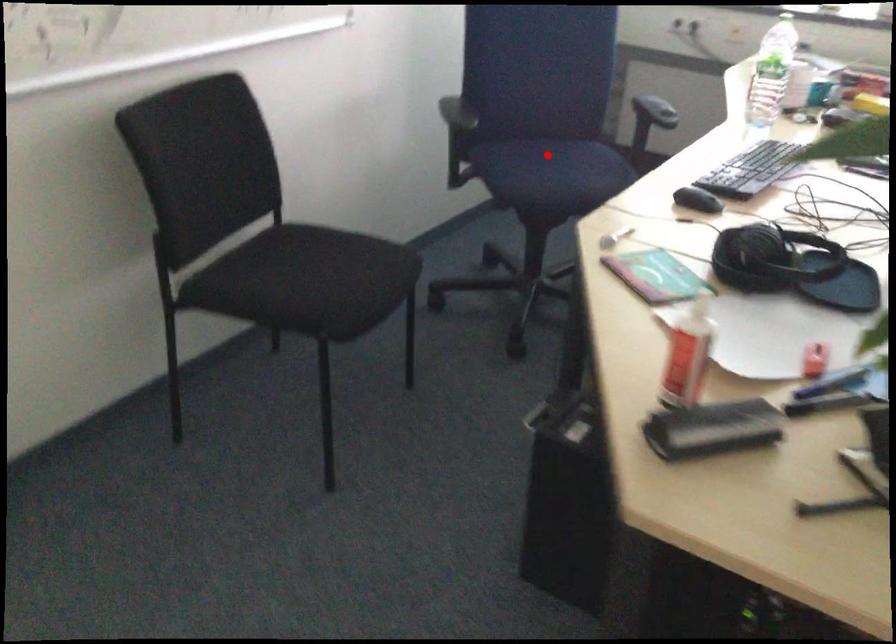
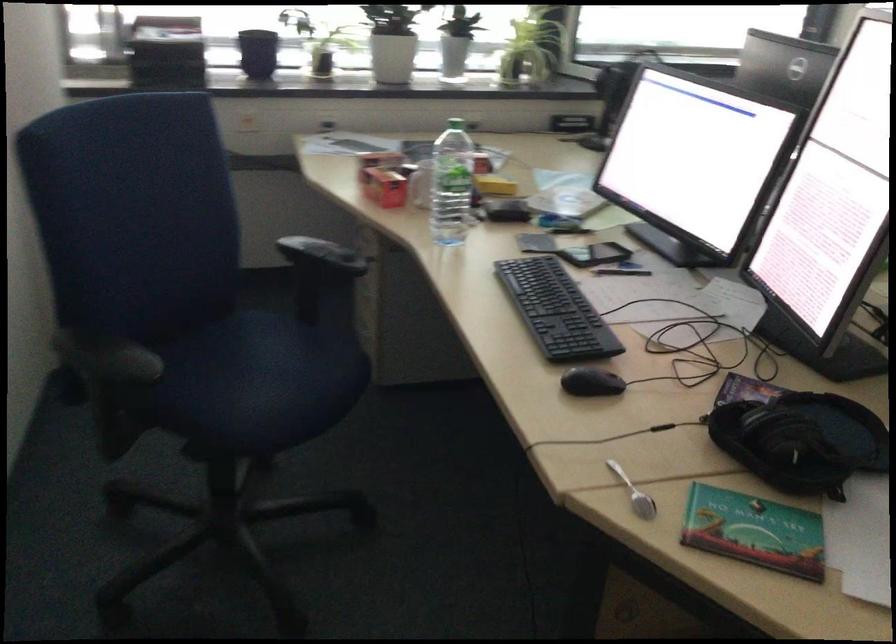
Question: A red point is marked in image1. In image2, is the corresponding 3D point closer to the camera or farther? Reply with the corresponding letter.

Choices:
 (A) The corresponding 3D point is closer.
 (B) The corresponding 3D point is farther.

Answer: (A)